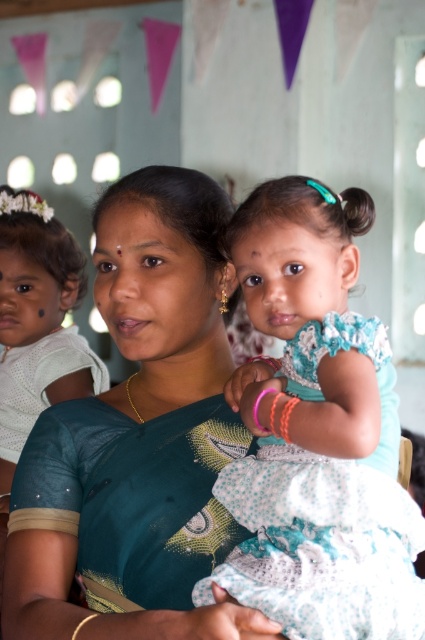
You are a photographer standing in front of the scene. You want to capture a photo where both the teal silk saree at center and the light blue fabric dress at center are clearly visible. Which object should you focus on first to ensure both are in focus?

You should focus on the teal silk saree at center first because it is closer to you than the light blue fabric dress at center, ensuring both will be in focus when focused on the closer object.

You are a tailor measuring the distance between the teal silk saree at center and the light blue fabric dress at center for a photo shoot. The minimum required distance for proper lighting is 8 inches. Is the current distance sufficient?

The distance between the teal silk saree at center and the light blue fabric dress at center is 7.82 inches, which is slightly less than the required 8 inches. Therefore, the current distance is not sufficient for proper lighting.